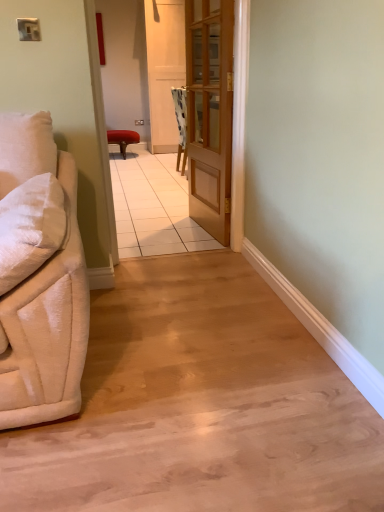
Question: Considering the relative sizes of matte red stool at center and wooden door at center in the image provided, is matte red stool at center smaller than wooden door at center?

Choices:
 (A) yes
 (B) no

Answer: (B)

Question: Is matte red stool at center to the right of wooden door at center from the viewer's perspective?

Choices:
 (A) yes
 (B) no

Answer: (B)

Question: Can we say matte red stool at center lies outside wooden door at center?

Choices:
 (A) no
 (B) yes

Answer: (B)

Question: From the image's perspective, is matte red stool at center under wooden door at center?

Choices:
 (A) no
 (B) yes

Answer: (A)

Question: From the image's perspective, is matte red stool at center located above wooden door at center?

Choices:
 (A) no
 (B) yes

Answer: (B)

Question: Considering their positions, is wooden door at center located in front of or behind velvet beige couch at left?

Choices:
 (A) front
 (B) behind

Answer: (B)

Question: From the image's perspective, is wooden door at center above or below velvet beige couch at left?

Choices:
 (A) below
 (B) above

Answer: (B)

Question: Considering the relative positions of wooden door at center and velvet beige couch at left in the image provided, is wooden door at center to the left or to the right of velvet beige couch at left?

Choices:
 (A) left
 (B) right

Answer: (B)

Question: Based on their sizes in the image, would you say wooden door at center is bigger or smaller than velvet beige couch at left?

Choices:
 (A) small
 (B) big

Answer: (B)

Question: In terms of height, does velvet beige couch at left look taller or shorter compared to wooden screen door at center?

Choices:
 (A) tall
 (B) short

Answer: (B)

Question: Based on their sizes in the image, would you say velvet beige couch at left is bigger or smaller than wooden screen door at center?

Choices:
 (A) big
 (B) small

Answer: (B)

Question: From the image's perspective, relative to wooden screen door at center, is velvet beige couch at left above or below?

Choices:
 (A) below
 (B) above

Answer: (A)

Question: Would you say velvet beige couch at left is inside or outside wooden screen door at center?

Choices:
 (A) inside
 (B) outside

Answer: (B)

Question: From a real-world perspective, is wooden door at center physically located above or below matte red stool at center?

Choices:
 (A) above
 (B) below

Answer: (A)

Question: Visually, is wooden door at center positioned to the left or to the right of matte red stool at center?

Choices:
 (A) left
 (B) right

Answer: (B)